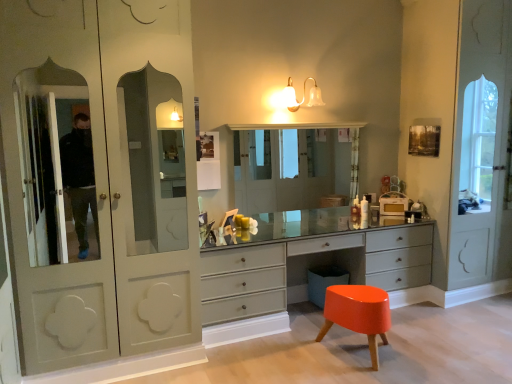
Question: Can you confirm if translucent glass sconce at upper center is taller than clear glass medicine cabinet at center?

Choices:
 (A) yes
 (B) no

Answer: (B)

Question: Considering the relative sizes of translucent glass sconce at upper center and clear glass medicine cabinet at center in the image provided, is translucent glass sconce at upper center bigger than clear glass medicine cabinet at center?

Choices:
 (A) no
 (B) yes

Answer: (A)

Question: Could you tell me if translucent glass sconce at upper center is facing clear glass medicine cabinet at center?

Choices:
 (A) no
 (B) yes

Answer: (A)

Question: Is translucent glass sconce at upper center looking in the opposite direction of clear glass medicine cabinet at center?

Choices:
 (A) no
 (B) yes

Answer: (A)

Question: Can you confirm if translucent glass sconce at upper center is positioned to the right of clear glass medicine cabinet at center?

Choices:
 (A) no
 (B) yes

Answer: (A)

Question: Can you confirm if translucent glass sconce at upper center is positioned to the left of clear glass medicine cabinet at center?

Choices:
 (A) yes
 (B) no

Answer: (A)

Question: Is orange glossy stool at lower right taller than satin gray dresser at center?

Choices:
 (A) no
 (B) yes

Answer: (A)

Question: Does orange glossy stool at lower right come in front of satin gray dresser at center?

Choices:
 (A) yes
 (B) no

Answer: (A)

Question: Would you say orange glossy stool at lower right contains satin gray dresser at center?

Choices:
 (A) no
 (B) yes

Answer: (A)

Question: Would you say orange glossy stool at lower right is a long distance from satin gray dresser at center?

Choices:
 (A) no
 (B) yes

Answer: (A)

Question: Can you confirm if orange glossy stool at lower right is bigger than satin gray dresser at center?

Choices:
 (A) no
 (B) yes

Answer: (A)

Question: From the image's perspective, does orange glossy stool at lower right appear lower than satin gray dresser at center?

Choices:
 (A) yes
 (B) no

Answer: (A)

Question: Is orange glossy stool at lower right smaller than clear glass medicine cabinet at center?

Choices:
 (A) yes
 (B) no

Answer: (B)